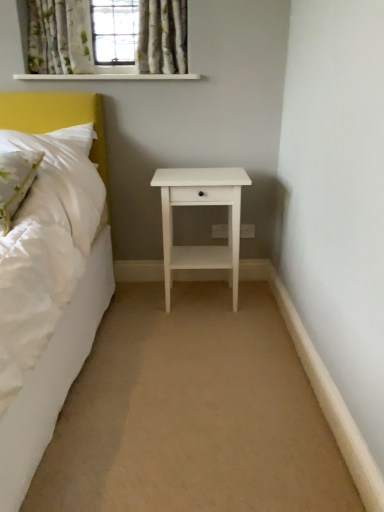
Question: Which direction should I rotate to look at floral fabric curtain at upper center, which is counted as the second curtain, starting from the left?

Choices:
 (A) right
 (B) left

Answer: (B)

Question: From the image's perspective, is green floral fabric curtain at upper left, which is counted as the 1th curtain, starting from the left, on green floral fabric pillow at left?

Choices:
 (A) no
 (B) yes

Answer: (B)

Question: Can you confirm if green floral fabric curtain at upper left, the second curtain positioned from the right, is smaller than green floral fabric pillow at left?

Choices:
 (A) no
 (B) yes

Answer: (B)

Question: From a real-world perspective, is green floral fabric curtain at upper left, the second curtain positioned from the right, physically below green floral fabric pillow at left?

Choices:
 (A) no
 (B) yes

Answer: (A)

Question: Is green floral fabric curtain at upper left, the second curtain positioned from the right, facing towards green floral fabric pillow at left?

Choices:
 (A) yes
 (B) no

Answer: (B)

Question: Is green floral fabric pillow at left a part of green floral fabric curtain at upper left, which is counted as the 1th curtain, starting from the left?

Choices:
 (A) no
 (B) yes

Answer: (A)

Question: Can you confirm if green floral fabric curtain at upper left, the second curtain positioned from the right, is positioned to the left of green floral fabric pillow at left?

Choices:
 (A) no
 (B) yes

Answer: (A)

Question: Is beige carpet at center directly adjacent to white matte nightstand at center?

Choices:
 (A) yes
 (B) no

Answer: (B)

Question: Is beige carpet at center bigger than white matte nightstand at center?

Choices:
 (A) no
 (B) yes

Answer: (A)

Question: Considering the relative positions of beige carpet at center and white matte nightstand at center in the image provided, is beige carpet at center in front of white matte nightstand at center?

Choices:
 (A) yes
 (B) no

Answer: (A)

Question: Could you tell me if beige carpet at center is turned towards white matte nightstand at center?

Choices:
 (A) yes
 (B) no

Answer: (B)

Question: Would you say beige carpet at center is outside white matte nightstand at center?

Choices:
 (A) no
 (B) yes

Answer: (B)

Question: Is beige carpet at center far from white matte nightstand at center?

Choices:
 (A) yes
 (B) no

Answer: (B)

Question: Considering the relative sizes of green floral fabric pillow at left and floral fabric curtain at upper center, the 1th curtain positioned from the right, in the image provided, is green floral fabric pillow at left shorter than floral fabric curtain at upper center, the 1th curtain positioned from the right,?

Choices:
 (A) no
 (B) yes

Answer: (B)